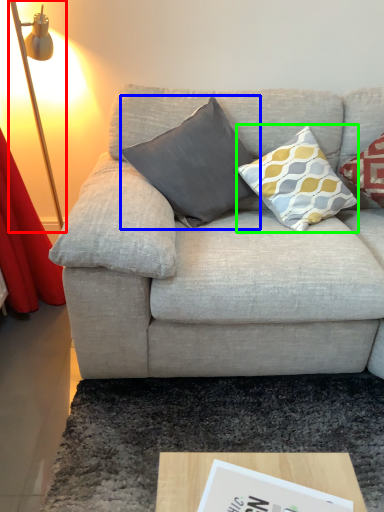
Question: Based on their relative distances, which object is nearer to table lamp (highlighted by a red box)? Choose from pillow (highlighted by a blue box) and pillow (highlighted by a green box).

Choices:
 (A) pillow
 (B) pillow

Answer: (A)